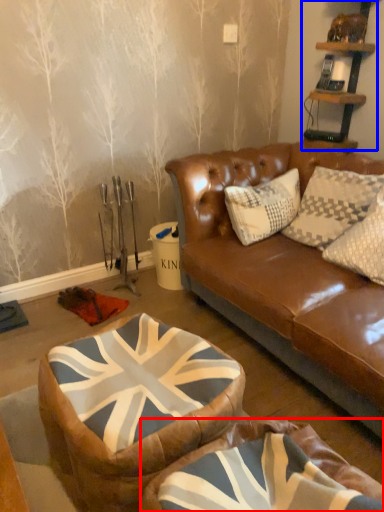
Question: Which object appears closest to the camera in this image, bean bag chair (highlighted by a red box) or shelf (highlighted by a blue box)?

Choices:
 (A) bean bag chair
 (B) shelf

Answer: (A)